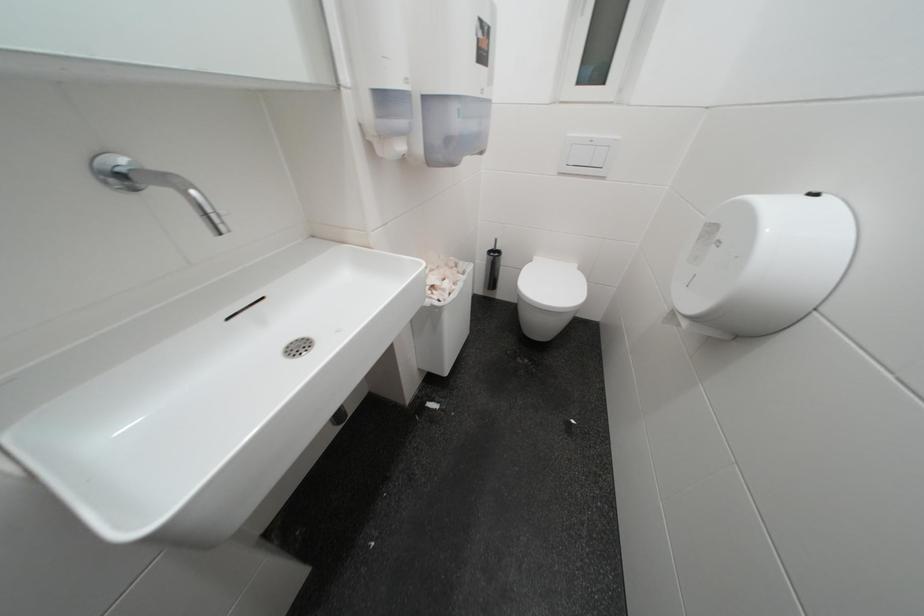
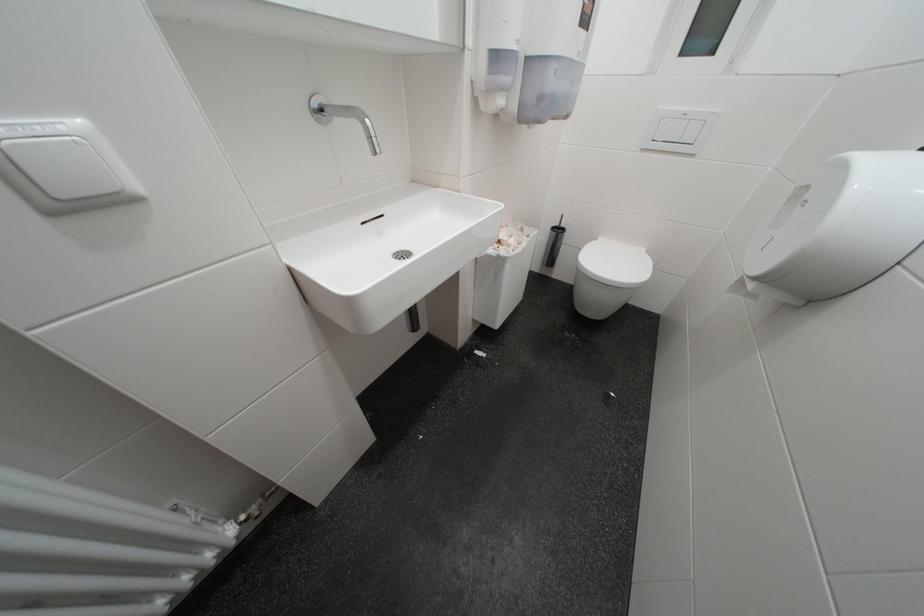
Question: Which direction would the cameraman need to move to produce the second image? Reply with the corresponding letter.

Choices:
 (A) Left
 (B) Right
 (C) Forward
 (D) Backward

Answer: (D)